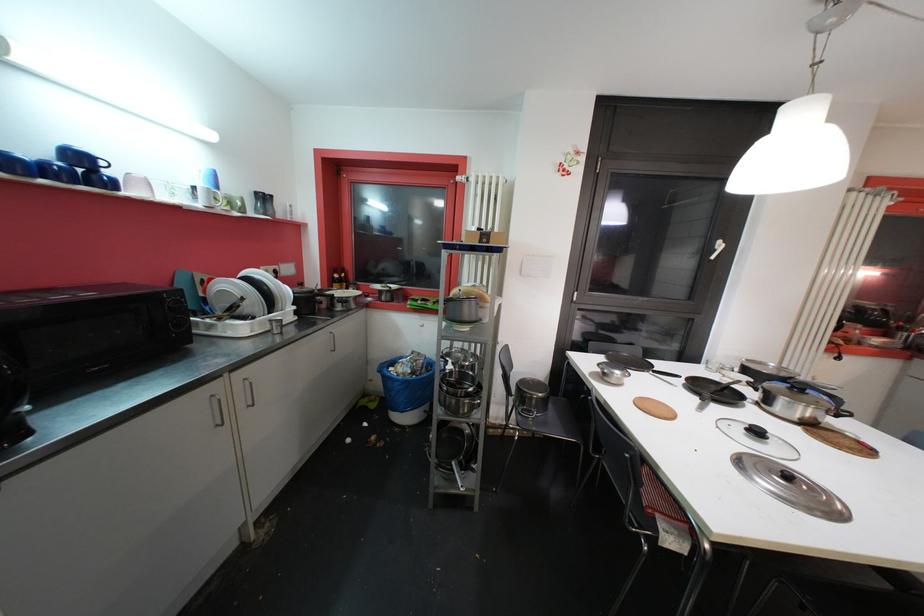
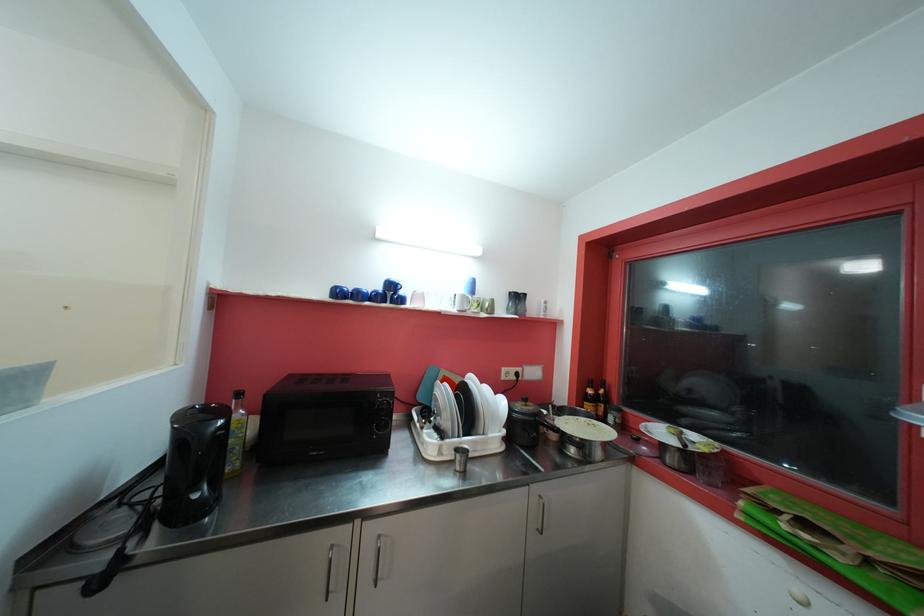
The point at (345,283) is marked in the first image. Where is the corresponding point in the second image?

(601, 402)